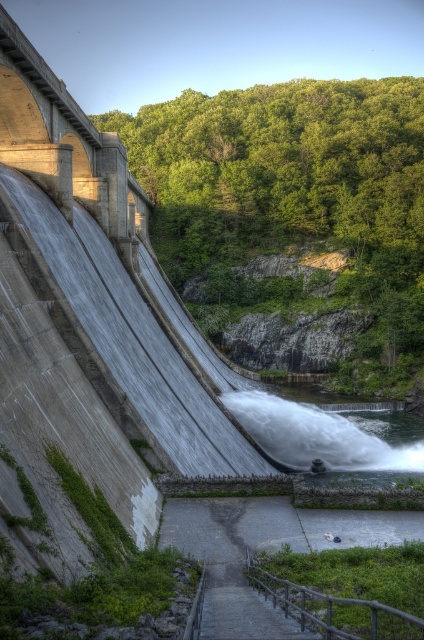
Is concrete bridge at left bigger than white frothy water at lower center?

Indeed, concrete bridge at left has a larger size compared to white frothy water at lower center.

Does point (27, 54) come farther from viewer compared to point (253, 426)?

No, (27, 54) is closer to viewer.

Locate an element on the screen. This screenshot has width=424, height=640. concrete bridge at left is located at coordinates (64, 144).